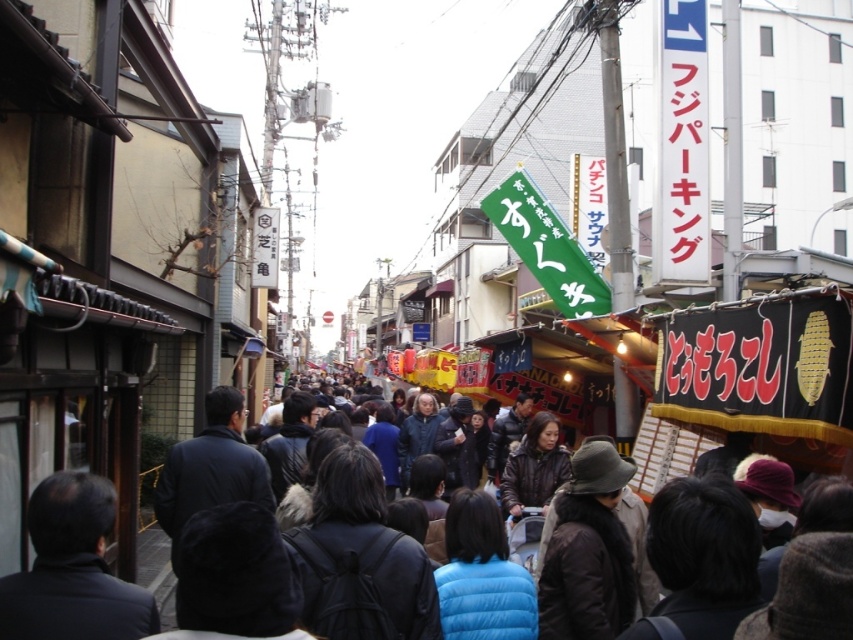
You are a delivery person trying to navigate through the crowd on the street. You notice the white plastic sign at upper right and the dark brown leather jacket at center. Which object is taller and could potentially block your view ahead?

The white plastic sign at upper right is much taller than the dark brown leather jacket at center, so it could potentially block your view ahead more significantly.

You are a delivery person trying to navigate through the crowd. You see a white plastic sign at upper right and a dark brown leather jacket at center. Which object is narrower in width?

The white plastic sign at upper right is narrower in width than the dark brown leather jacket at center.

You are a tourist in Japan and want to read the white plastic sign at upper right but are currently standing in front of the dark brown leather jacket at center. Which direction should you move to reach the sign?

The white plastic sign at upper right is to the right of the dark brown leather jacket at center, so you should move to your right to reach it.